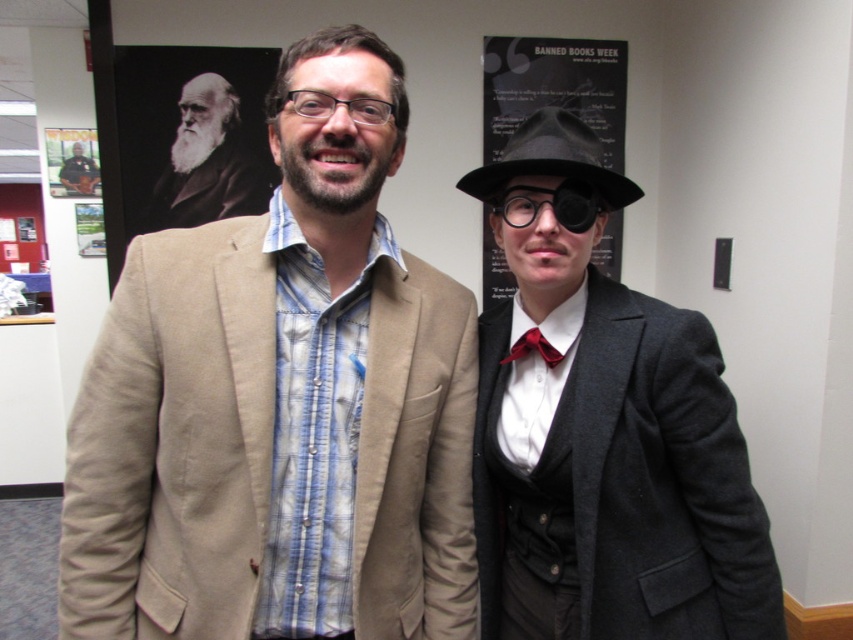
Which of these two, matte black jacket at center or matte red bow tie at center, stands shorter?

matte red bow tie at center is shorter.

This screenshot has width=853, height=640. What do you see at coordinates (78, 172) in the screenshot?
I see `matte black jacket at center` at bounding box center [78, 172].

I want to click on matte black jacket at center, so click(x=78, y=172).

Where is `gray beard at upper left`? This screenshot has width=853, height=640. gray beard at upper left is located at coordinates (207, 163).

Does gray beard at upper left appear over matte black jacket at center?

Actually, gray beard at upper left is below matte black jacket at center.

Identify the location of gray beard at upper left. (207, 163).

Locate an element on the screen. This screenshot has width=853, height=640. gray beard at upper left is located at coordinates (207, 163).

Can you confirm if clear plastic goggles at center is smaller than matte red bow tie at center?

No.

In the scene shown: Who is higher up, clear plastic goggles at center or matte red bow tie at center?

clear plastic goggles at center

Locate an element on the screen. The height and width of the screenshot is (640, 853). clear plastic goggles at center is located at coordinates (550, 204).